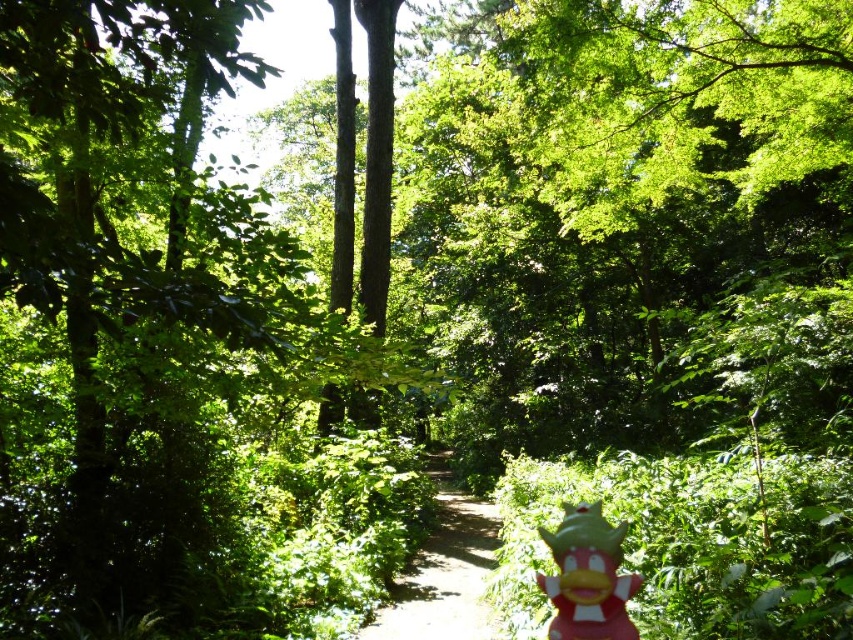
Which is above, dirt path at center or rubber duck at lower right?

rubber duck at lower right

Can you confirm if dirt path at center is positioned above rubber duck at lower right?

No.

Where is `dirt path at center`? The width and height of the screenshot is (853, 640). dirt path at center is located at coordinates (445, 572).